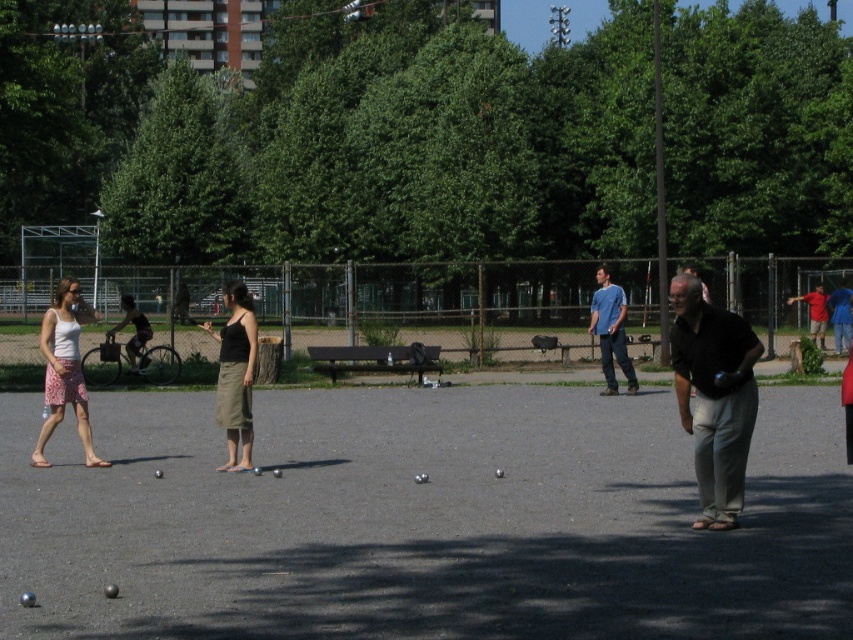
Question: Which point is closer to the camera?

Choices:
 (A) (599, 317)
 (B) (239, 467)
 (C) (689, 356)
 (D) (819, 339)

Answer: (C)

Question: Can you confirm if dark green skirt at center is positioned above red shirt at center?

Choices:
 (A) yes
 (B) no

Answer: (B)

Question: Which point appears closest to the camera in this image?

Choices:
 (A) [67, 307]
 (B) [814, 326]
 (C) [721, 339]
 (D) [601, 305]

Answer: (C)

Question: Which object is the farthest from the light pink floral skirt at left?

Choices:
 (A) matte blue shirt at center
 (B) red shirt at center
 (C) dark green skirt at center
 (D) dark brown shirt at center

Answer: (B)

Question: Does matte blue shirt at center appear over dark gray fabric shirt at left?

Choices:
 (A) yes
 (B) no

Answer: (B)

Question: Observing the image, what is the correct spatial positioning of dark green skirt at center in reference to dark gray fabric shirt at left?

Choices:
 (A) below
 (B) above

Answer: (A)